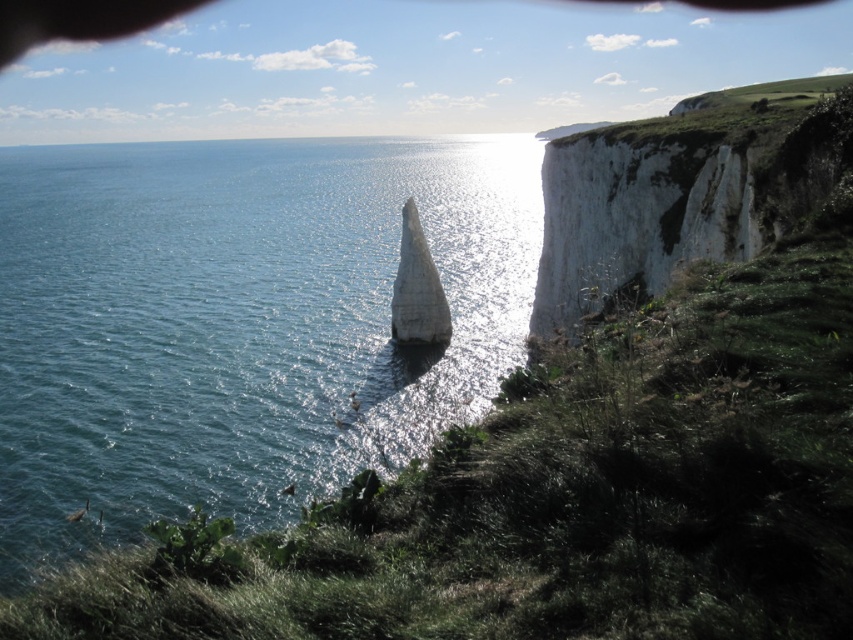
Does blue water at center have a larger size compared to white rocky cliff at upper right?

Correct, blue water at center is larger in size than white rocky cliff at upper right.

Who is more forward, [421,404] or [805,182]?

Positioned in front is point [805,182].

This screenshot has width=853, height=640. What do you see at coordinates (239, 323) in the screenshot?
I see `blue water at center` at bounding box center [239, 323].

You are a GUI agent. You are given a task and a screenshot of the screen. Output one action in this format:
    pyautogui.click(x=<x>, y=<y>)
    Task: Click on the blue water at center
    The width and height of the screenshot is (853, 640).
    Given the screenshot: What is the action you would take?
    pyautogui.click(x=239, y=323)